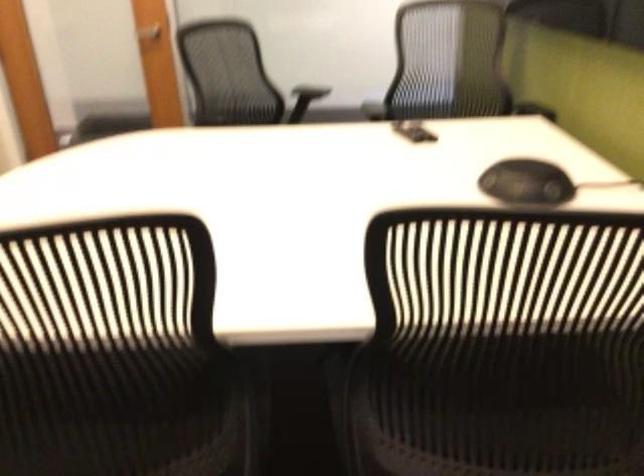
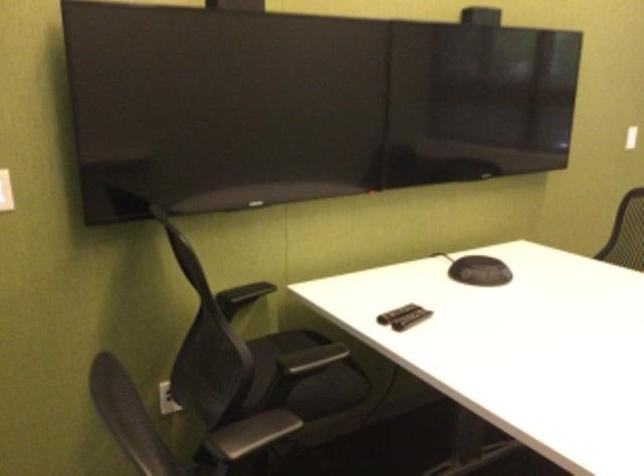
In the second image, find the point that corresponds to point (402, 130) in the first image.

(411, 319)